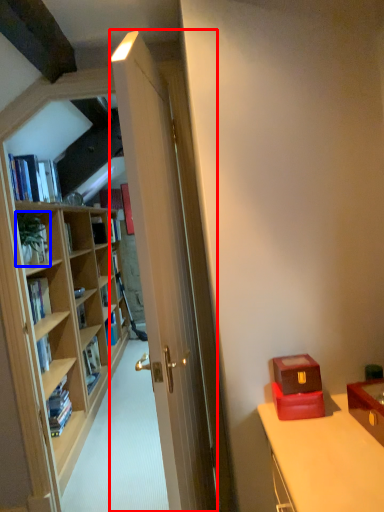
Question: Which object appears farthest to the camera in this image, door (highlighted by a red box) or houseplant (highlighted by a blue box)?

Choices:
 (A) door
 (B) houseplant

Answer: (B)